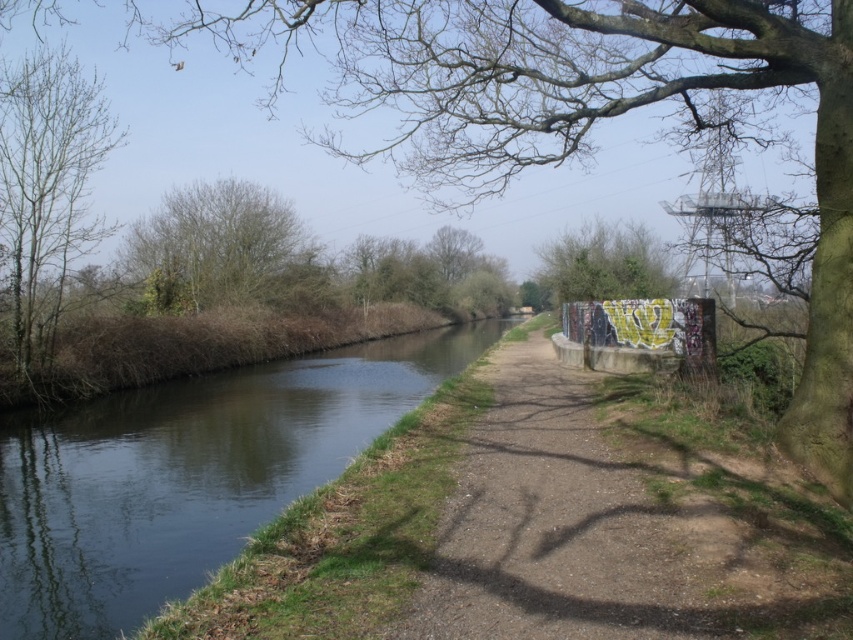
Is dirt/gravel path at center thinner than green leafy tree at upper left?

Correct, dirt/gravel path at center's width is less than green leafy tree at upper left's.

Who is more forward, (x=579, y=410) or (x=224, y=182)?

Point (x=579, y=410)

You are a GUI agent. You are given a task and a screenshot of the screen. Output one action in this format:
    pyautogui.click(x=<x>, y=<y>)
    Task: Click on the dirt/gravel path at center
    
    Given the screenshot: What is the action you would take?
    pyautogui.click(x=619, y=525)

Looking at this image, does dirt/gravel path at center lie behind bare branches at left?

No, it is in front of bare branches at left.

Is dirt/gravel path at center below bare branches at left?

Yes.

Which is in front, point (538, 349) or point (111, 225)?

Point (538, 349) is more forward.

Locate an element on the screen. The image size is (853, 640). dirt/gravel path at center is located at coordinates (619, 525).

Measure the distance from bare branches at left to green leafy tree at upper left.

bare branches at left and green leafy tree at upper left are 13.34 meters apart from each other.

Is bare branches at left behind green leafy tree at upper left?

No, bare branches at left is in front of green leafy tree at upper left.

At what (x,y) coordinates should I click in order to perform the action: click on bare branches at left. Please return your answer as a coordinate pair (x, y). Looking at the image, I should click on (45, 189).